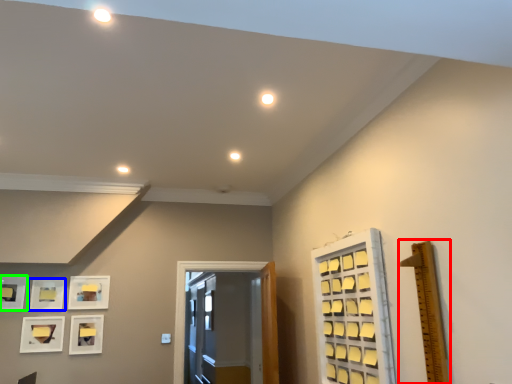
Question: Which is nearer to the ruler (highlighted by a red box)? picture frame (highlighted by a blue box) or picture frame (highlighted by a green box).

Choices:
 (A) picture frame
 (B) picture frame

Answer: (A)